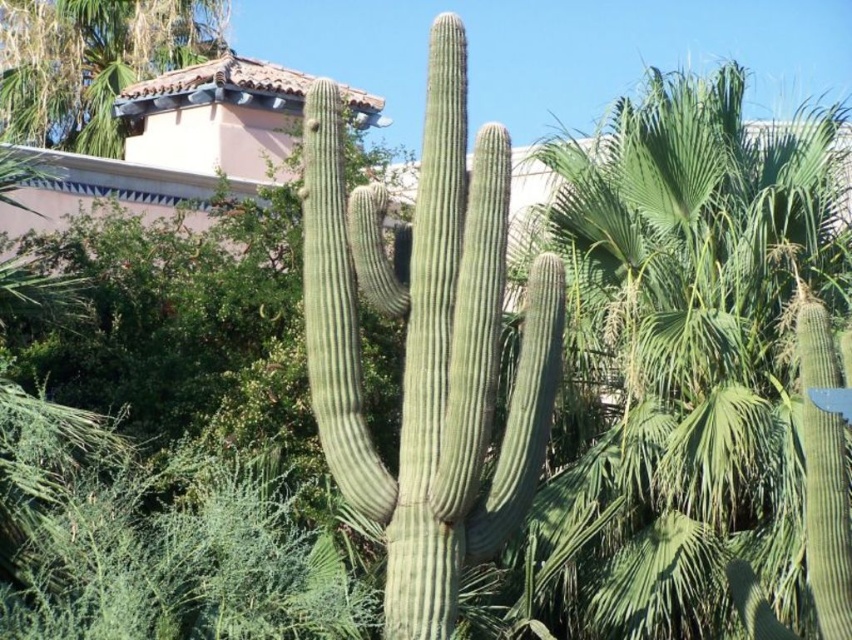
Does green leafy palm tree at center appear over green matte cactus at upper left?

Incorrect, green leafy palm tree at center is not positioned above green matte cactus at upper left.

Which is in front, point (798, 285) or point (73, 4)?

Point (798, 285)

This screenshot has width=852, height=640. I want to click on green leafy palm tree at center, so click(x=707, y=360).

Can you confirm if green spiny cactus at center is thinner than green matte cactus at upper left?

Yes.

Does green spiny cactus at center have a smaller size compared to green matte cactus at upper left?

Yes.

Where is `green spiny cactus at center`? The height and width of the screenshot is (640, 852). green spiny cactus at center is located at coordinates (427, 342).

Does green leafy palm tree at center have a greater width compared to green spiny cactus at center?

Incorrect, green leafy palm tree at center's width does not surpass green spiny cactus at center's.

Is point (709, 614) closer to camera compared to point (304, 236)?

No, (709, 614) is further to viewer.

Identify the location of green leafy palm tree at center. Image resolution: width=852 pixels, height=640 pixels. (707, 360).